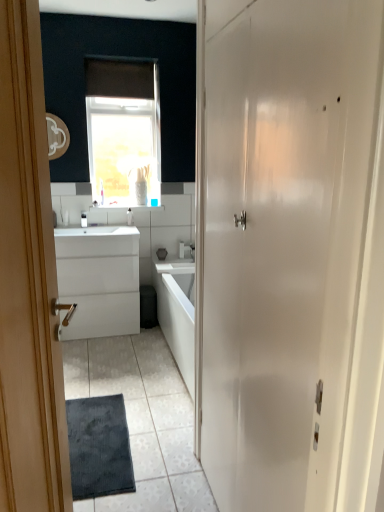
Question: Can you confirm if white plastic toothbrush at upper center, which is counted as the 2th toiletry, starting from the left, is bigger than white glossy door at right, which ranks as the first door in right-to-left order?

Choices:
 (A) yes
 (B) no

Answer: (B)

Question: Is white plastic toothbrush at upper center, which is counted as the 2th toiletry, starting from the left, in contact with white glossy door at right, which ranks as the first door in right-to-left order?

Choices:
 (A) no
 (B) yes

Answer: (A)

Question: Is white plastic toothbrush at upper center, which ranks as the first toiletry in right-to-left order, thinner than white glossy door at right, positioned as the second door in left-to-right order?

Choices:
 (A) yes
 (B) no

Answer: (A)

Question: Can you confirm if white plastic toothbrush at upper center, which ranks as the first toiletry in right-to-left order, is smaller than white glossy door at right, which ranks as the first door in right-to-left order?

Choices:
 (A) no
 (B) yes

Answer: (B)

Question: From a real-world perspective, is white plastic toothbrush at upper center, which ranks as the first toiletry in right-to-left order, located higher than white glossy door at right, positioned as the second door in left-to-right order?

Choices:
 (A) no
 (B) yes

Answer: (A)

Question: Is satin nickel faucet at center wider or thinner than white glossy sink at center?

Choices:
 (A) wide
 (B) thin

Answer: (B)

Question: From the image's perspective, is satin nickel faucet at center above or below white glossy sink at center?

Choices:
 (A) above
 (B) below

Answer: (B)

Question: From a real-world perspective, is satin nickel faucet at center above or below white glossy sink at center?

Choices:
 (A) below
 (B) above

Answer: (A)

Question: Considering the positions of satin nickel faucet at center and white glossy sink at center in the image, is satin nickel faucet at center taller or shorter than white glossy sink at center?

Choices:
 (A) short
 (B) tall

Answer: (B)

Question: Do you think white glossy sink at center is within white glossy cabinet at center, or outside of it?

Choices:
 (A) inside
 (B) outside

Answer: (A)

Question: Is white glossy sink at center taller or shorter than white glossy cabinet at center?

Choices:
 (A) tall
 (B) short

Answer: (B)

Question: From the image's perspective, is white glossy sink at center above or below white glossy cabinet at center?

Choices:
 (A) below
 (B) above

Answer: (B)

Question: Does point (76, 227) appear closer or farther from the camera than point (122, 263)?

Choices:
 (A) closer
 (B) farther

Answer: (B)

Question: Is white glossy sink at center wider or thinner than white plastic toothbrush at center, which is the 2th toiletry in right-to-left order?

Choices:
 (A) wide
 (B) thin

Answer: (A)

Question: In terms of height, does white glossy sink at center look taller or shorter compared to white plastic toothbrush at center, which is the 2th toiletry in right-to-left order?

Choices:
 (A) short
 (B) tall

Answer: (A)